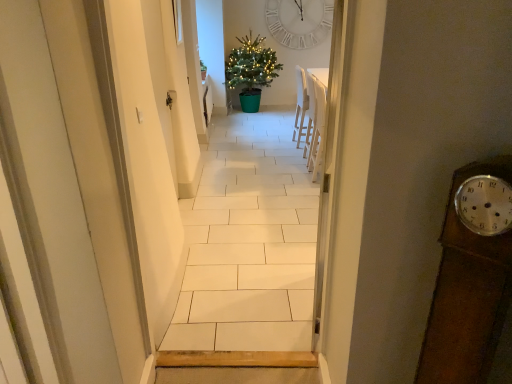
Question: Can you confirm if white tile floor at center is bigger than white wooden clock at upper center?

Choices:
 (A) yes
 (B) no

Answer: (A)

Question: Can you confirm if white tile floor at center is smaller than white wooden clock at upper center?

Choices:
 (A) yes
 (B) no

Answer: (B)

Question: Does white tile floor at center appear on the right side of white wooden clock at upper center?

Choices:
 (A) yes
 (B) no

Answer: (B)

Question: Can you confirm if white tile floor at center is wider than white wooden clock at upper center?

Choices:
 (A) yes
 (B) no

Answer: (A)

Question: Are white tile floor at center and white wooden clock at upper center located far from each other?

Choices:
 (A) yes
 (B) no

Answer: (A)

Question: From their relative heights in the image, would you say white plastic chair at upper right is taller or shorter than green glossy plant at center?

Choices:
 (A) tall
 (B) short

Answer: (A)

Question: Considering their positions, is white plastic chair at upper right located in front of or behind green glossy plant at center?

Choices:
 (A) front
 (B) behind

Answer: (A)

Question: From a real-world perspective, is white plastic chair at upper right above or below green glossy plant at center?

Choices:
 (A) above
 (B) below

Answer: (B)

Question: Considering the positions of white plastic chair at upper right and green glossy plant at center in the image, is white plastic chair at upper right bigger or smaller than green glossy plant at center?

Choices:
 (A) big
 (B) small

Answer: (A)

Question: From the image's perspective, is green glossy plant at center above or below white tile floor at center?

Choices:
 (A) above
 (B) below

Answer: (A)

Question: Considering the positions of green glossy plant at center and white tile floor at center in the image, is green glossy plant at center wider or thinner than white tile floor at center?

Choices:
 (A) thin
 (B) wide

Answer: (B)

Question: Considering the relative positions of green glossy plant at center and white tile floor at center in the image provided, is green glossy plant at center to the left or to the right of white tile floor at center?

Choices:
 (A) left
 (B) right

Answer: (A)

Question: Is green glossy plant at center inside the boundaries of white tile floor at center, or outside?

Choices:
 (A) outside
 (B) inside

Answer: (A)

Question: From the image's perspective, relative to green glossy plant at center, is green plastic christmas tree at center above or below?

Choices:
 (A) above
 (B) below

Answer: (A)

Question: Would you say green plastic christmas tree at center is to the left or to the right of green glossy plant at center in the picture?

Choices:
 (A) right
 (B) left

Answer: (A)